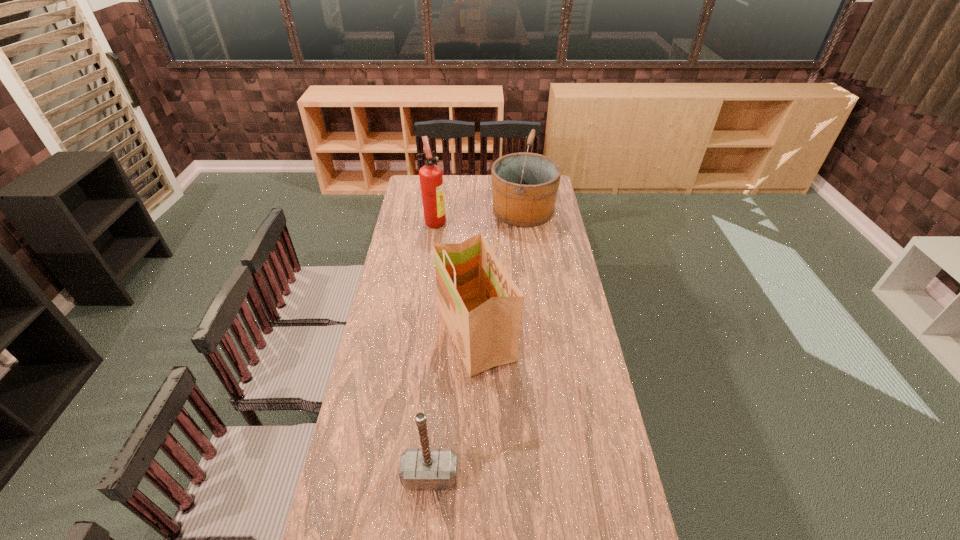
You are a GUI agent. You are given a task and a screenshot of the screen. Output one action in this format:
    pyautogui.click(x=<x>, y=<y>)
    Task: Click on the fire extinguisher
    The height and width of the screenshot is (540, 960).
    Given the screenshot: What is the action you would take?
    pyautogui.click(x=431, y=179)

Identify the location of bucket. This screenshot has width=960, height=540. (524, 185).

In order to click on grocery bag in this screenshot , I will do `click(482, 307)`.

Where is `the nearest object`? This screenshot has width=960, height=540. the nearest object is located at coordinates (425, 468).

This screenshot has height=540, width=960. I want to click on the shortest object, so click(425, 468).

Find the location of a particular element. The image size is (960, 540). vacant region located on the front-facing side of the fire extinguisher is located at coordinates (507, 221).

I want to click on vacant space located on the back of the bucket, so click(x=519, y=181).

This screenshot has width=960, height=540. Identify the location of vacant area situated on the left of the grocery bag. (375, 334).

Where is `vacant area situated 0.050m on the striking surface of the hammer`? vacant area situated 0.050m on the striking surface of the hammer is located at coordinates (427, 510).

What are the coordinates of `object that is at the far edge` in the screenshot? It's located at (524, 185).